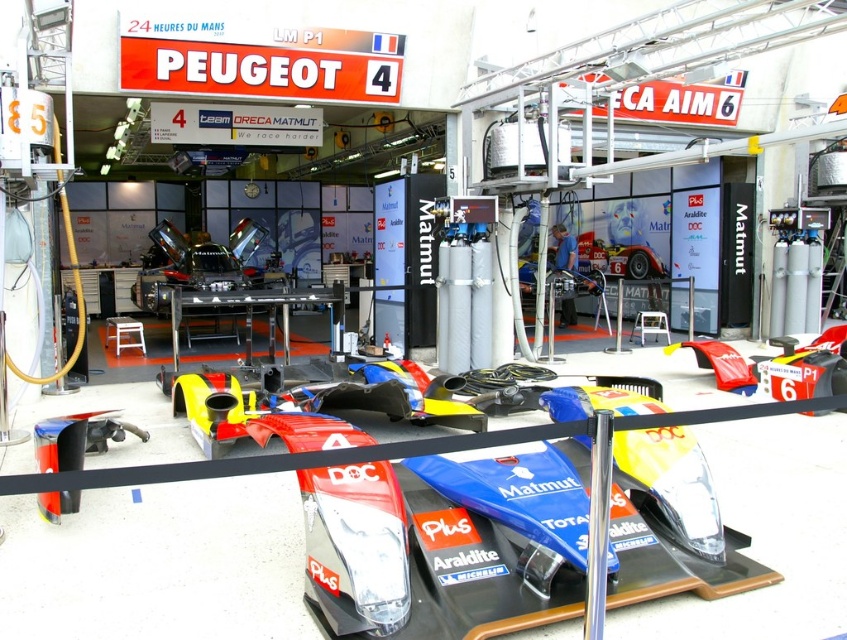
You are a technician who needs to move a 2.5 meter long tool cart between the shiny blue carbon fiber race car at center and the nearest object to it. Is there enough space for the tool cart to pass through?

The shiny blue carbon fiber race car at center and the nearest object are 3.10 meters apart, so yes, the tool cart which is 2.5 meters long can pass through the space between them.

You are a photographer positioned at the back of the garage. You want to take a photo of the shiny blue carbon fiber race car at center and the metallic silver mechanic at center. Will the mechanic be visible in the photo if you focus on the race car?

The shiny blue carbon fiber race car at center is in front of the metallic silver mechanic at center, so if you focus on the race car, the mechanic might be partially or fully obscured depending on the camera angle and zoom. However, since the mechanic is behind the car, they may not be visible in the photo if the car is in focus and occupies the foreground.

You are a photographer standing in the garage area of the 24 Heures du Mans event. You need to capture a photo of both the silver metallic race car at center and the metallic silver mechanic at center. Based on their sizes, which object should you focus on first to ensure it fits properly in the frame?

The silver metallic race car at center is taller than the metallic silver mechanic at center, so you should focus on capturing the silver metallic race car at center first to ensure its full height is included in the frame.